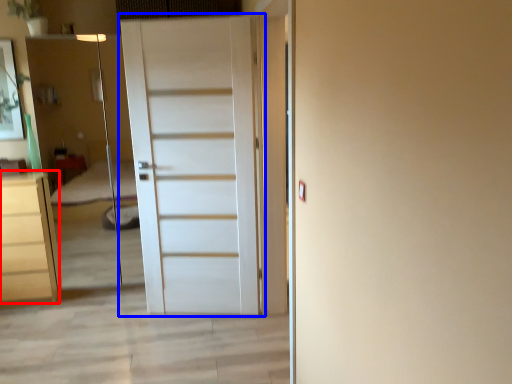
Question: Which object appears farthest to the camera in this image, chest of drawers (highlighted by a red box) or door (highlighted by a blue box)?

Choices:
 (A) chest of drawers
 (B) door

Answer: (A)